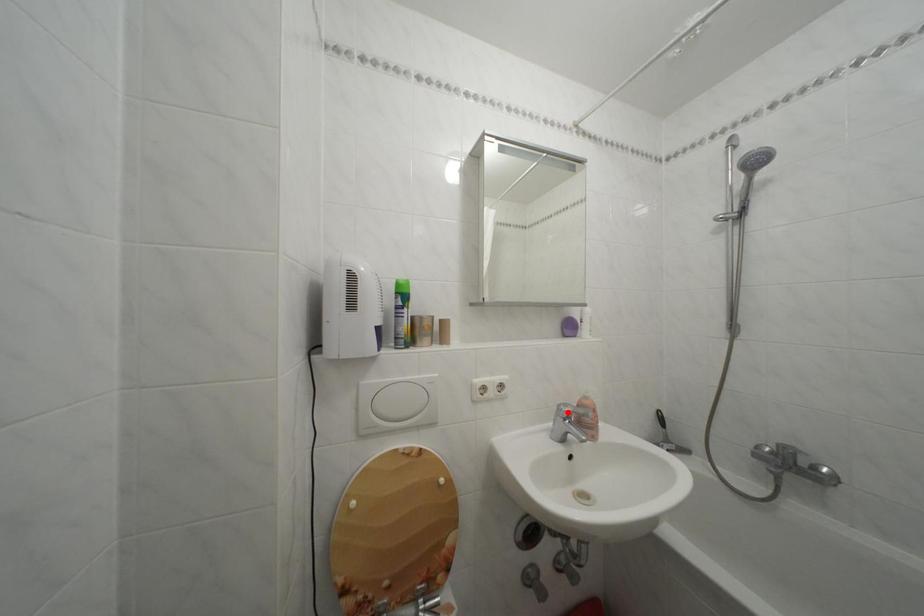
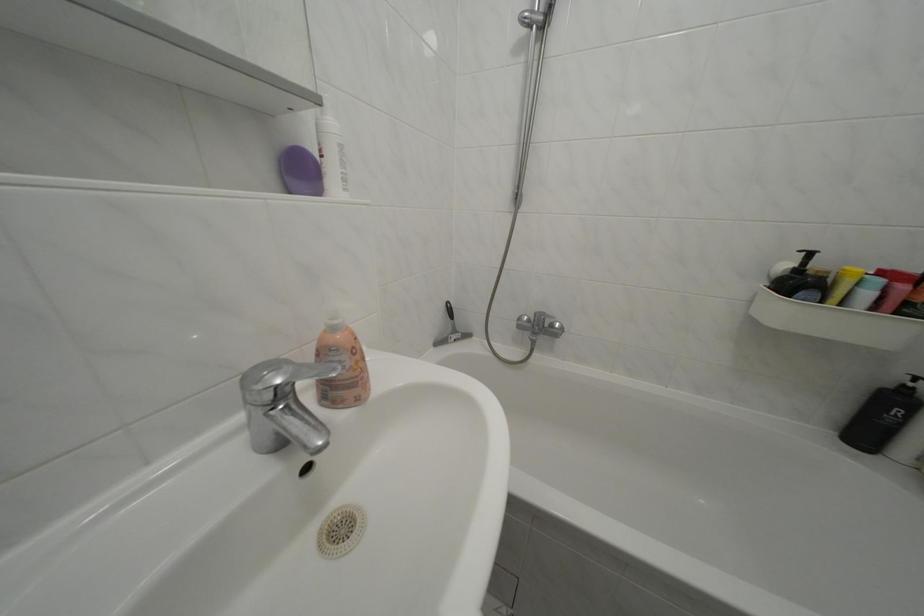
Where in the second image is the point corresponding to the highlighted location from the first image?

(252, 384)